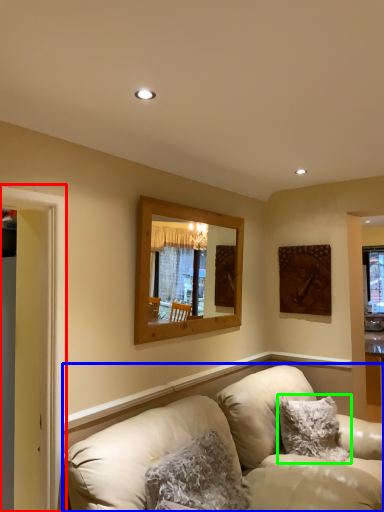
Question: Which object is positioned closest to window frame (highlighted by a red box)? Select from studio couch (highlighted by a blue box) and pillow (highlighted by a green box).

Choices:
 (A) studio couch
 (B) pillow

Answer: (A)